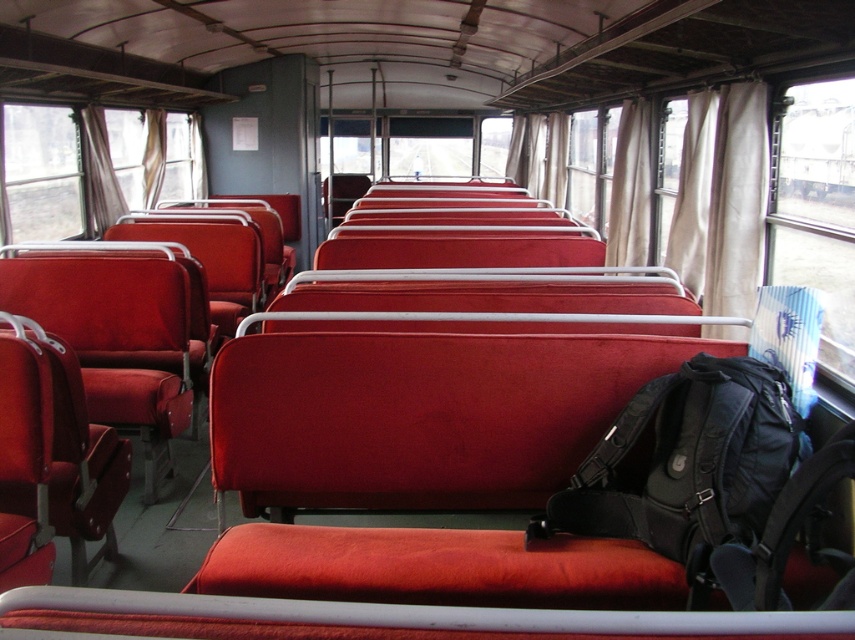
Which is behind, point (116, 138) or point (7, 116)?

Point (116, 138)

Is the position of transparent fabric window at upper left less distant than that of transparent glass window at left?

Yes, transparent fabric window at upper left is closer to the viewer.

Who is more distant from viewer, (x=4, y=122) or (x=22, y=196)?

The point (x=22, y=196) is behind.

Locate an element on the screen. Image resolution: width=855 pixels, height=640 pixels. transparent fabric window at upper left is located at coordinates (42, 172).